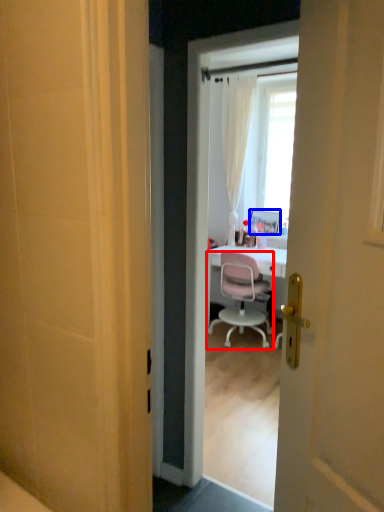
Question: Which point is closer to the camera, chair (highlighted by a red box) or picture frame (highlighted by a blue box)?

Choices:
 (A) chair
 (B) picture frame

Answer: (A)